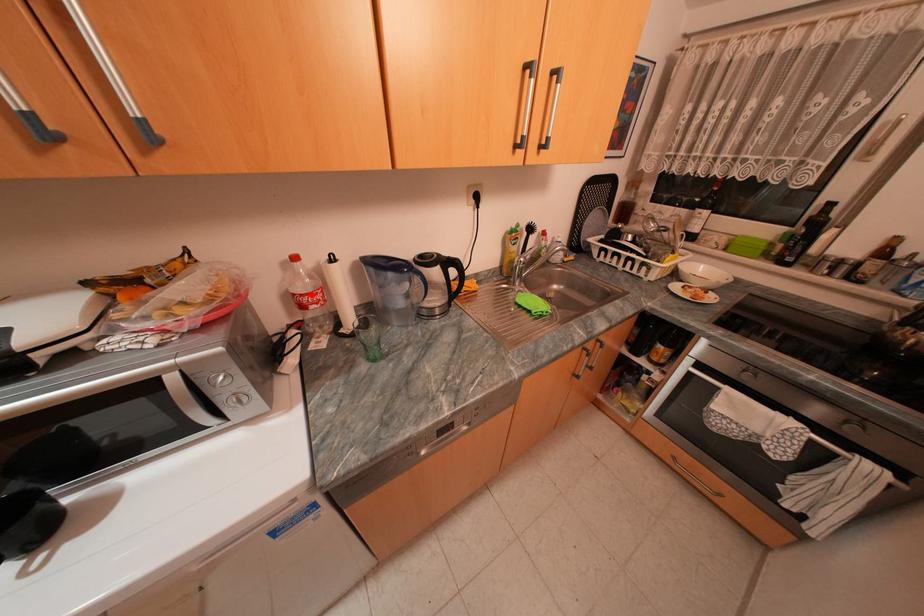
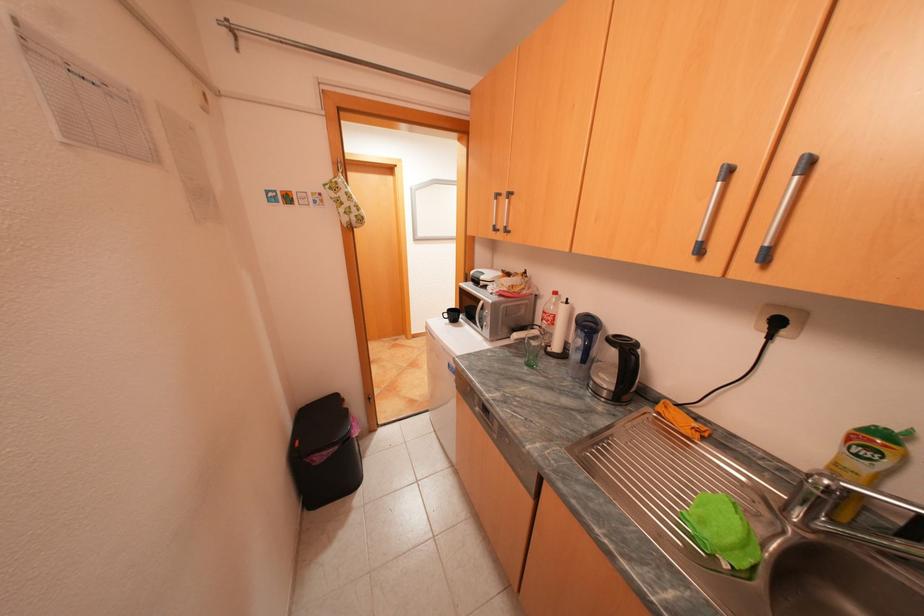
Question: I am providing you with two images of the same scene from different viewpoints. A red point is marked on the first image. Is the red point's position out of view in image 2?

Choices:
 (A) Yes
 (B) No

Answer: (B)